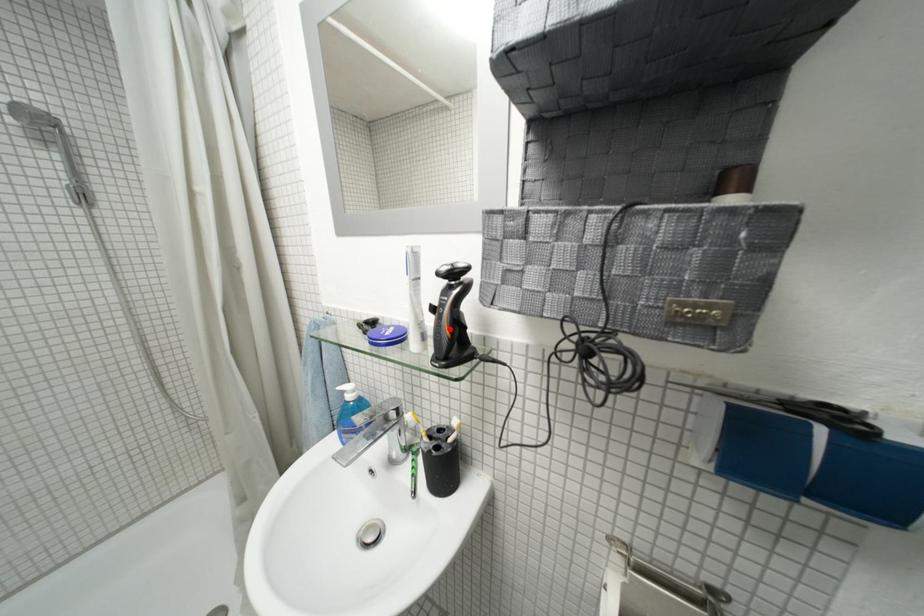
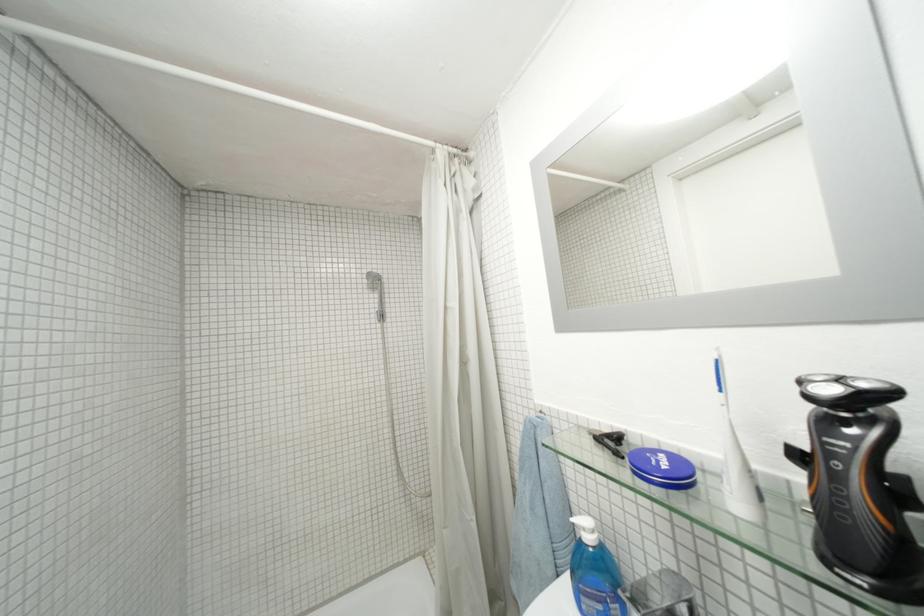
Where in the second image is the point corresponding to the highlighted location from the first image?

(857, 501)